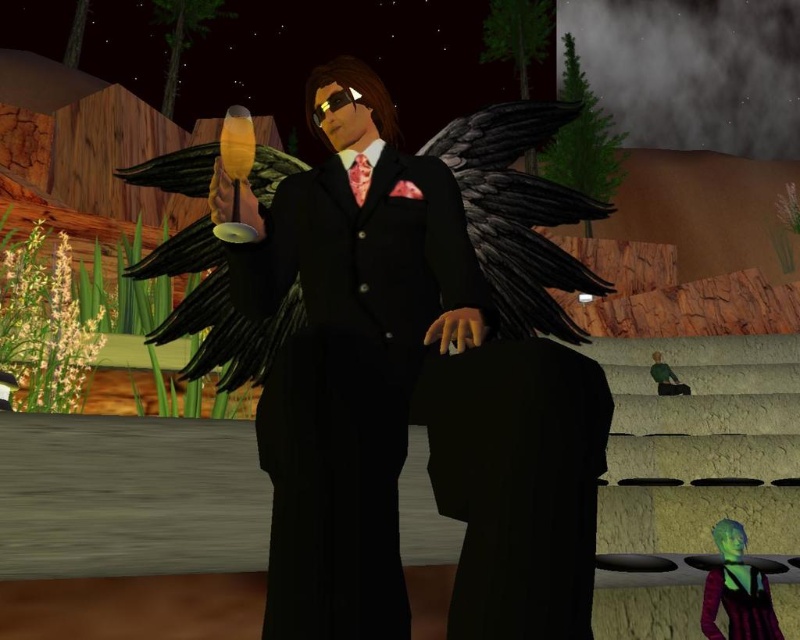
You are a fashion designer who needs to place a new accessory between the black satin suit at center and the purple striped dress at lower right. Given that the accessory requires 1.5 meters of space to be displayed properly, will there be enough space between them?

The distance between the black satin suit at center and the purple striped dress at lower right is 1.76 meters, which is more than the required 1.5 meters. Therefore, there is sufficient space to place the accessory between them.

You are a character in the game who needs to locate a specific point in the image. The point is at coordinates point (350, 353). Where exactly is this point located in relation to the objects in the scene?

The point (350, 353) is located on the black satin suit at center.

You are a costume designer preparing for a play. You need to ensure that the black satin suit at center will fit under the black matte wings at center during a scene where the character moves their arms. Based on the image, will the suit be wide enough to allow the wings to move freely without obstruction?

The black satin suit at center has a lesser width compared to black matte wings at center, so the suit may not be wide enough to allow the wings to move freely without obstruction.